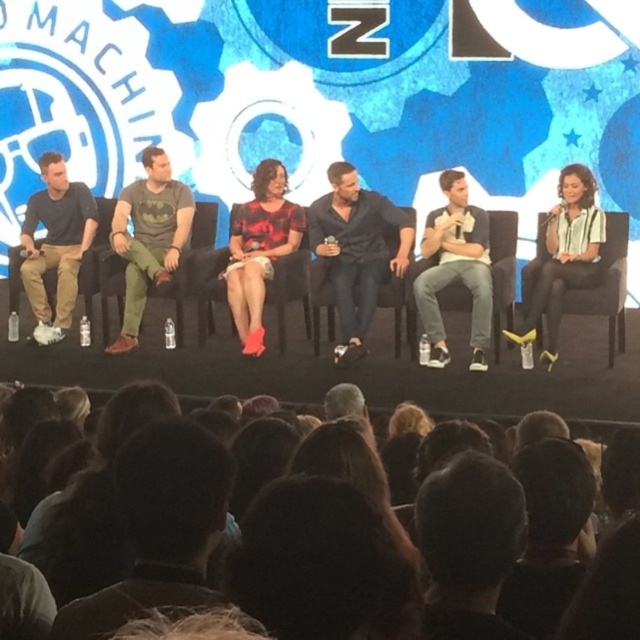
Question: Is matte black shirt at left thinner than dark hair at lower center?

Choices:
 (A) no
 (B) yes

Answer: (A)

Question: Among these points, which one is farthest from the camera?

Choices:
 (A) (342, 237)
 (B) (67, 328)
 (C) (456, 257)

Answer: (B)

Question: Is dark brown hair at lower center closer to camera compared to dark hair at lower center?

Choices:
 (A) yes
 (B) no

Answer: (A)

Question: Which point is closer to the camera taking this photo?

Choices:
 (A) (563, 236)
 (B) (269, 266)

Answer: (A)

Question: Which point is closer to the camera?

Choices:
 (A) dark hair at lower center
 (B) batman t-shirt at center

Answer: (A)

Question: Can you confirm if red floral dress at center is wider than dark hair at lower center?

Choices:
 (A) no
 (B) yes

Answer: (B)